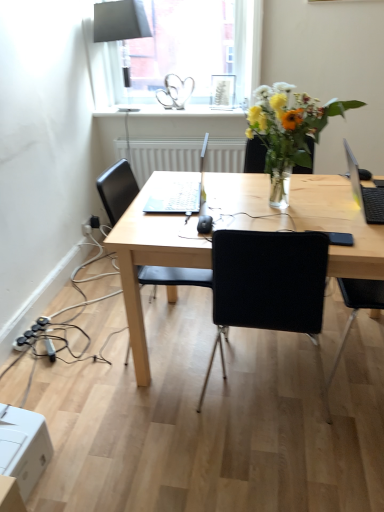
Question: Looking at the image, does black matte laptop at right seem bigger or smaller compared to white cardboard box at lower left?

Choices:
 (A) small
 (B) big

Answer: (A)

Question: From a real-world perspective, relative to white cardboard box at lower left, is black matte laptop at right vertically above or below?

Choices:
 (A) below
 (B) above

Answer: (B)

Question: Estimate the real-world distances between objects in this image. Which object is closer to the translucent glass vase at upper right?

Choices:
 (A) transparent glass window at upper center
 (B) black plastic power plugs and sockets at lower left
 (C) white cardboard box at lower left
 (D) black plastic chair at center
 (E) matte black lampshade at upper center

Answer: (D)

Question: Which is farther from the transparent glass window at upper center?

Choices:
 (A) white glossy window sill at upper center
 (B) black plastic mouse at center
 (C) matte black lampshade at upper center
 (D) black plastic chair at center
 (E) black plastic power plugs and sockets at lower left

Answer: (E)